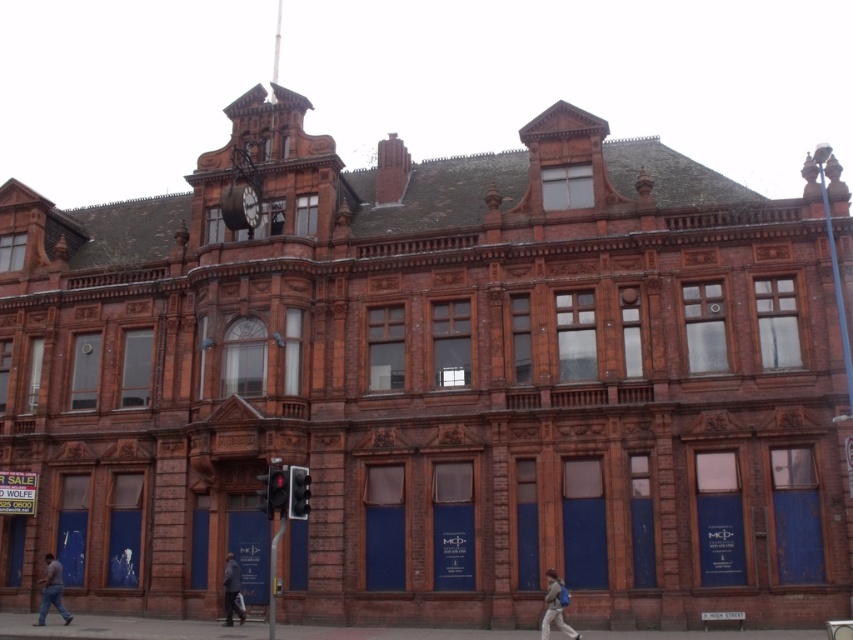
You are standing in front of the ornate building and notice both the blue jeans at lower left and the metallic clock at upper center. Which object is nearer to you?

The blue jeans at lower left is closer to the viewer than the metallic clock at upper center.

You are standing in front of the ornate building and notice two items near the base. The matte gray jacket at lower right and the blue jeans at lower left. Which item is taller?

The matte gray jacket at lower right is taller than the blue jeans at lower left.